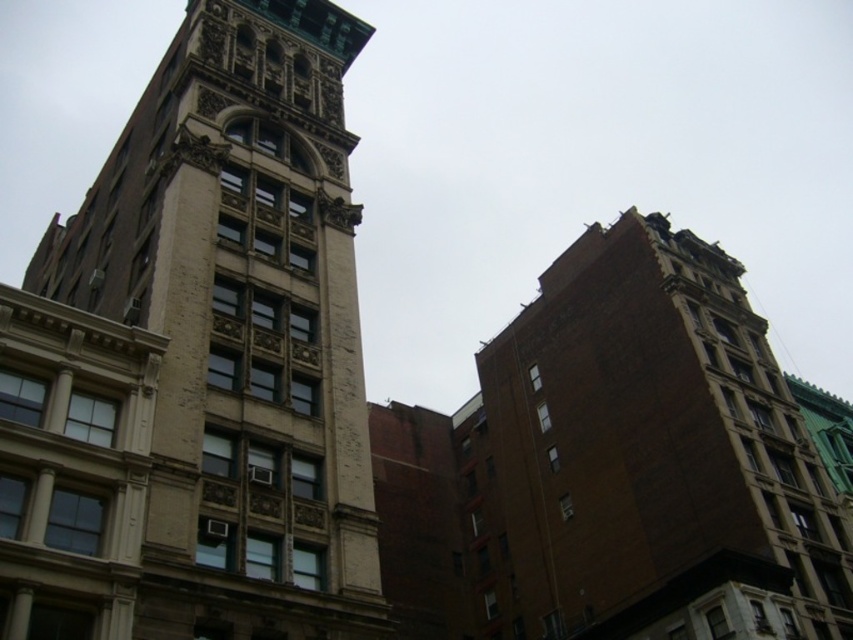
You are standing in the urban landscape and want to determine the distance between two points marked in the image. The first point is at coordinate point [119,358] and the second is at coordinate point [646,518]. Based on their positions, which point is nearer to you?

Point [119,358] is closer to the viewer than point [646,518].

You are a tourist standing in the middle of the street between the white stone tower at center and the brown brick tower at right. Which tower is closer to your left side?

The white stone tower at center is to the left of the brown brick tower at right, so the white stone tower at center is closer to your left side.